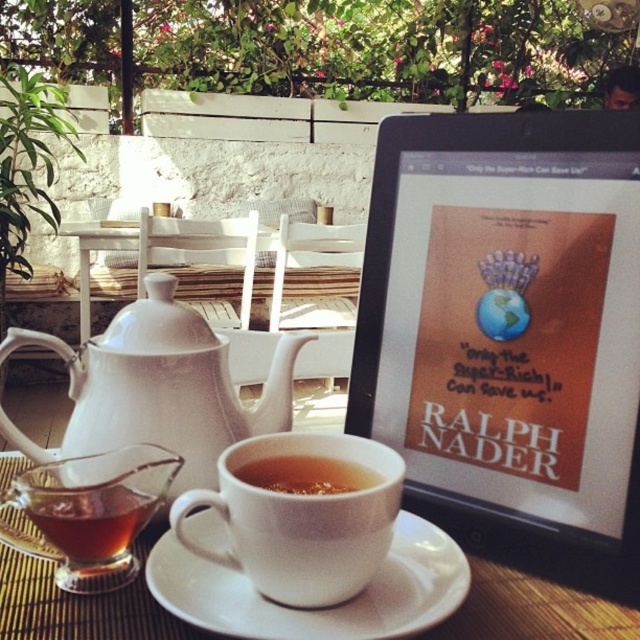
How far apart are white ceramic cup at center and translucent glass cup at lower left?

3.42 inches

Which is in front, point (392, 454) or point (104, 512)?

Point (104, 512) is in front.

Is point (259, 564) farther from camera compared to point (150, 513)?

That is False.

This screenshot has width=640, height=640. What are the coordinates of `white ceramic cup at center` in the screenshot? It's located at (301, 518).

Is white ceramic saucer at center bigger than translucent glass cup at lower left?

Yes.

Can you confirm if white ceramic saucer at center is shorter than translucent glass cup at lower left?

Yes, white ceramic saucer at center is shorter than translucent glass cup at lower left.

In order to click on white ceramic saucer at center in this screenshot , I will do `click(323, 609)`.

You are a GUI agent. You are given a task and a screenshot of the screen. Output one action in this format:
    pyautogui.click(x=<x>, y=<y>)
    Task: Click on the white ceramic saucer at center
    This screenshot has width=640, height=640.
    Given the screenshot: What is the action you would take?
    pyautogui.click(x=323, y=609)

Between point (262, 429) and point (305, 470), which one is positioned in front?

Point (305, 470) is in front.

Can you confirm if white glossy teapot at center-left is thinner than translucent glass cup at center?

In fact, white glossy teapot at center-left might be wider than translucent glass cup at center.

Does point (188, 420) come in front of point (328, 492)?

No.

Where is `white glossy teapot at center-left`? white glossy teapot at center-left is located at coordinates (157, 387).